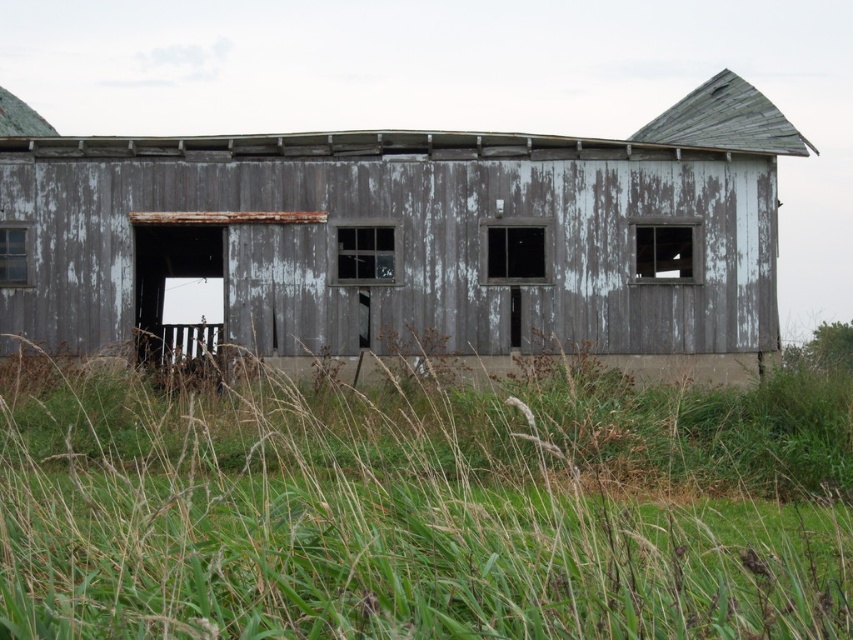
Question: Considering the relative positions of green grass at lower center and weathered gray wood barn at center in the image provided, where is green grass at lower center located with respect to weathered gray wood barn at center?

Choices:
 (A) below
 (B) above

Answer: (A)

Question: Is the position of green grass at lower center more distant than that of weathered gray wood barn at center?

Choices:
 (A) no
 (B) yes

Answer: (A)

Question: Which point appears closest to the camera in this image?

Choices:
 (A) (289, 276)
 (B) (498, 554)

Answer: (B)

Question: Does green grass at lower center appear on the left side of weathered gray wood barn at center?

Choices:
 (A) yes
 (B) no

Answer: (B)